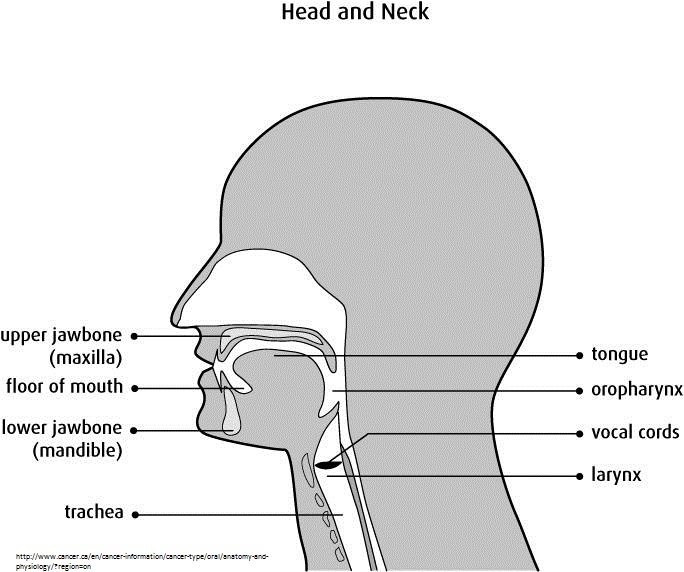
This screenshot has width=684, height=572. In order to click on picture in this screenshot , I will do `click(418, 319)`.